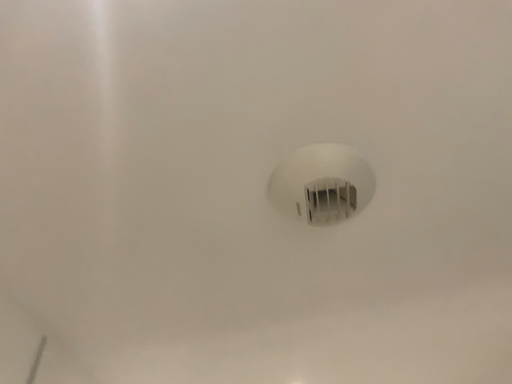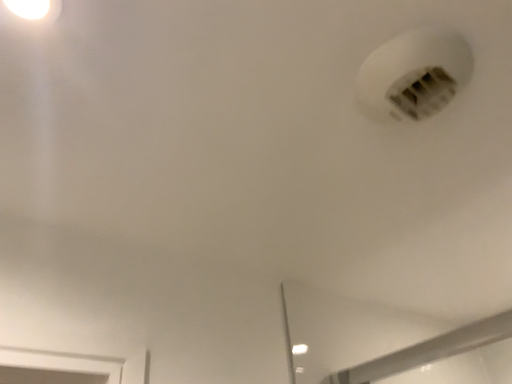
Question: How did the camera likely rotate when shooting the video?

Choices:
 (A) rotated left
 (B) rotated right

Answer: (A)